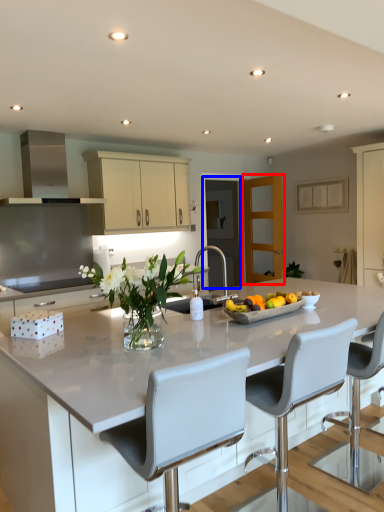
Question: Among these objects, which one is farthest to the camera, glass door (highlighted by a red box) or glass door (highlighted by a blue box)?

Choices:
 (A) glass door
 (B) glass door

Answer: (B)